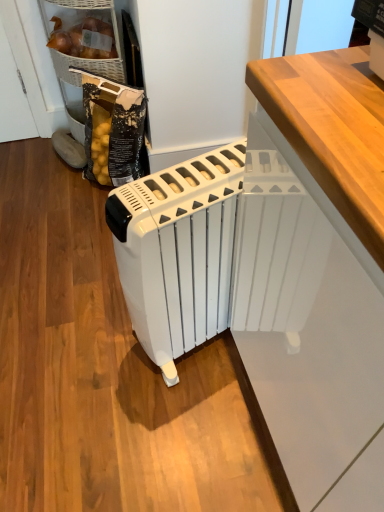
What do you see at coordinates (77, 23) in the screenshot? I see `matte wicker basket at upper left, arranged as the 1th cabinetry when viewed from the left` at bounding box center [77, 23].

You are a GUI agent. You are given a task and a screenshot of the screen. Output one action in this format:
    pyautogui.click(x=<x>, y=<y>)
    Task: Click on the white plastic radiator at center
    The image size is (384, 512).
    Given the screenshot: What is the action you would take?
    (x=178, y=252)

Where is `white glossy radiator at center, which ranks as the 2th cabinetry in left-to-right order`? Image resolution: width=384 pixels, height=512 pixels. white glossy radiator at center, which ranks as the 2th cabinetry in left-to-right order is located at coordinates (316, 273).

You are a GUI agent. You are given a task and a screenshot of the screen. Output one action in this format:
    pyautogui.click(x=<x>, y=<y>)
    Task: Click on the cabinetry on the left of the white glossy radiator at center, which ranks as the 2th cabinetry in left-to-right order
    This screenshot has width=384, height=512.
    Given the screenshot: What is the action you would take?
    pyautogui.click(x=77, y=23)

Is point (108, 11) farther from camera compared to point (266, 127)?

Yes.

Is matte wicker basket at upper left, arranged as the 1th cabinetry when viewed from the left, not inside white glossy radiator at center, the 2th cabinetry in the top-to-bottom sequence?

Yes, matte wicker basket at upper left, arranged as the 1th cabinetry when viewed from the left, is located beyond the bounds of white glossy radiator at center, the 2th cabinetry in the top-to-bottom sequence.

Is white glossy radiator at center, the first cabinetry viewed from the front, positioned far away from matte wicker basket at upper left, which ranks as the 1th cabinetry in back-to-front order?

white glossy radiator at center, the first cabinetry viewed from the front, is far away from matte wicker basket at upper left, which ranks as the 1th cabinetry in back-to-front order.

Measure the distance between white glossy radiator at center, which is the first cabinetry from bottom to top, and matte wicker basket at upper left, the 2th cabinetry when ordered from front to back.

A distance of 1.35 meters exists between white glossy radiator at center, which is the first cabinetry from bottom to top, and matte wicker basket at upper left, the 2th cabinetry when ordered from front to back.

Is the depth of white glossy radiator at center, the first cabinetry viewed from the front, greater than that of matte wicker basket at upper left, placed as the 2th cabinetry when sorted from bottom to top?

No, the depth of white glossy radiator at center, the first cabinetry viewed from the front, is less than that of matte wicker basket at upper left, placed as the 2th cabinetry when sorted from bottom to top.

Considering the sizes of objects white glossy radiator at center, which ranks as the 2th cabinetry in left-to-right order, and matte wicker basket at upper left, which ranks as the 1th cabinetry in back-to-front order, in the image provided, who is smaller, white glossy radiator at center, which ranks as the 2th cabinetry in left-to-right order, or matte wicker basket at upper left, which ranks as the 1th cabinetry in back-to-front order,?

matte wicker basket at upper left, which ranks as the 1th cabinetry in back-to-front order.

Image resolution: width=384 pixels, height=512 pixels. Find the location of `cabinetry lying below the white plastic radiator at center (from the image's perspective)`. cabinetry lying below the white plastic radiator at center (from the image's perspective) is located at coordinates (316, 273).

Is white glossy radiator at center, the 2th cabinetry in the top-to-bottom sequence, far away from white plastic radiator at center?

No.

Between white glossy radiator at center, which ranks as the 2th cabinetry in left-to-right order, and white plastic radiator at center, which one is positioned behind?

white plastic radiator at center is further away from the camera.

Between white plastic radiator at center and matte wicker basket at upper left, acting as the first cabinetry starting from the top, which one has more height?

white plastic radiator at center is taller.

Is there a large distance between white plastic radiator at center and matte wicker basket at upper left, which ranks as the 1th cabinetry in back-to-front order?

Yes, white plastic radiator at center is far from matte wicker basket at upper left, which ranks as the 1th cabinetry in back-to-front order.

Is white plastic radiator at center facing away from matte wicker basket at upper left, the 2th cabinetry in the right-to-left sequence?

No, white plastic radiator at center's orientation is not away from matte wicker basket at upper left, the 2th cabinetry in the right-to-left sequence.

Is white plastic radiator at center taller or shorter than white glossy radiator at center, the 2th cabinetry from the back?

Clearly, white plastic radiator at center is shorter compared to white glossy radiator at center, the 2th cabinetry from the back.

From a real-world perspective, is white plastic radiator at center physically located above or below white glossy radiator at center, the 2th cabinetry in the top-to-bottom sequence?

white plastic radiator at center is situated lower than white glossy radiator at center, the 2th cabinetry in the top-to-bottom sequence, in the real world.

In the image, is white plastic radiator at center positioned in front of or behind white glossy radiator at center, the 2th cabinetry in the top-to-bottom sequence?

white plastic radiator at center is behind white glossy radiator at center, the 2th cabinetry in the top-to-bottom sequence.

Consider the image. Is matte wicker basket at upper left, acting as the first cabinetry starting from the top, to the left of white plastic radiator at center from the viewer's perspective?

Correct, you'll find matte wicker basket at upper left, acting as the first cabinetry starting from the top, to the left of white plastic radiator at center.

Which of these two, matte wicker basket at upper left, placed as the 2th cabinetry when sorted from bottom to top, or white plastic radiator at center, is smaller?

Smaller between the two is matte wicker basket at upper left, placed as the 2th cabinetry when sorted from bottom to top.

How different are the orientations of matte wicker basket at upper left, placed as the 2th cabinetry when sorted from bottom to top, and white plastic radiator at center in degrees?

78.4 degrees.

Where is `cabinetry below the matte wicker basket at upper left, arranged as the 1th cabinetry when viewed from the left (from the image's perspective)`? The width and height of the screenshot is (384, 512). cabinetry below the matte wicker basket at upper left, arranged as the 1th cabinetry when viewed from the left (from the image's perspective) is located at coordinates (316, 273).

Find the location of `cabinetry behind the white glossy radiator at center, the first cabinetry viewed from the front`. cabinetry behind the white glossy radiator at center, the first cabinetry viewed from the front is located at coordinates (77, 23).

Looking at the image, which one is located further to white glossy radiator at center, the 2th cabinetry in the top-to-bottom sequence, white plastic radiator at center or matte wicker basket at upper left, the 2th cabinetry when ordered from front to back?

matte wicker basket at upper left, the 2th cabinetry when ordered from front to back, is further to white glossy radiator at center, the 2th cabinetry in the top-to-bottom sequence.

Based on their spatial positions, is matte wicker basket at upper left, arranged as the 1th cabinetry when viewed from the left, or white glossy radiator at center, the first cabinetry viewed from the front, further from white plastic radiator at center?

Among the two, matte wicker basket at upper left, arranged as the 1th cabinetry when viewed from the left, is located further to white plastic radiator at center.

In the scene shown: From the image, which object appears to be farther from white plastic radiator at center, white glossy radiator at center, which ranks as the 2th cabinetry in left-to-right order, or matte wicker basket at upper left, the 2th cabinetry when ordered from front to back?

Among the two, matte wicker basket at upper left, the 2th cabinetry when ordered from front to back, is located further to white plastic radiator at center.

Looking at the image, which one is located further to white glossy radiator at center, which ranks as the 2th cabinetry in left-to-right order, matte wicker basket at upper left, the 2th cabinetry when ordered from front to back, or white plastic radiator at center?

matte wicker basket at upper left, the 2th cabinetry when ordered from front to back, is further to white glossy radiator at center, which ranks as the 2th cabinetry in left-to-right order.

Estimate the real-world distances between objects in this image. Which object is closer to matte wicker basket at upper left, arranged as the 1th cabinetry when viewed from the left, white glossy radiator at center, the 2th cabinetry in the top-to-bottom sequence, or white plastic radiator at center?

white plastic radiator at center lies closer to matte wicker basket at upper left, arranged as the 1th cabinetry when viewed from the left, than the other object.

Estimate the real-world distances between objects in this image. Which object is further from matte wicker basket at upper left, acting as the first cabinetry starting from the top, white plastic radiator at center or white glossy radiator at center, the 2th cabinetry in the top-to-bottom sequence?

The object further to matte wicker basket at upper left, acting as the first cabinetry starting from the top, is white glossy radiator at center, the 2th cabinetry in the top-to-bottom sequence.

You are a GUI agent. You are given a task and a screenshot of the screen. Output one action in this format:
    pyautogui.click(x=<x>, y=<y>)
    Task: Click on the home appliance located between white glossy radiator at center, the 2th cabinetry in the top-to-bottom sequence, and matte wicker basket at upper left, arranged as the 1th cabinetry when viewed from the left, in the depth direction
    
    Given the screenshot: What is the action you would take?
    pyautogui.click(x=178, y=252)